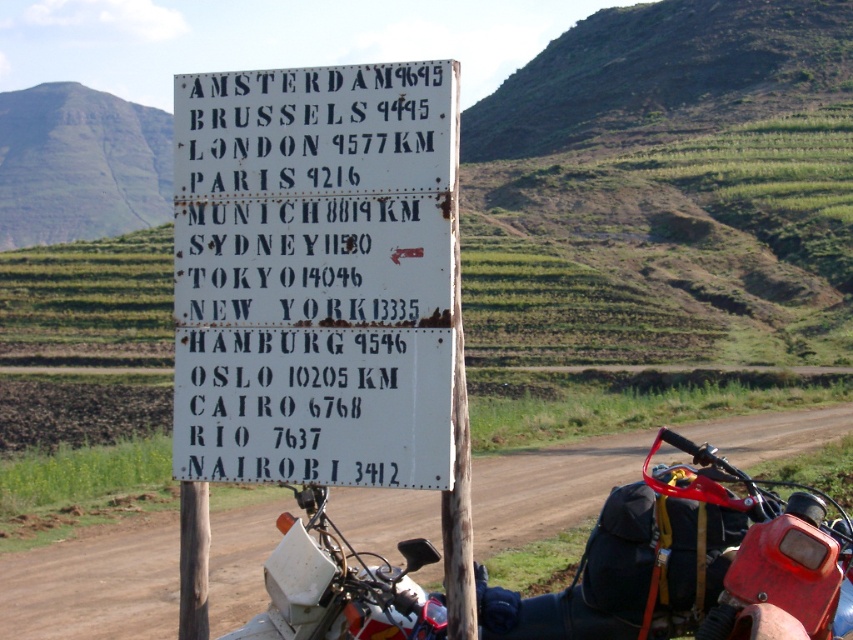
You are a traveler standing at the roadside scene. You see a white paper sign at center and a red plastic motorcycle at lower right. Which object is closer to your left side?

The white paper sign at center is to the left of red plastic motorcycle at lower right, so the white paper sign at center is closer to your left side.

You are a delivery robot with a 12 meter maximum reach. You need to pick up a package from the white paper sign at center and deliver it to the red plastic motorcycle at lower right. Can your arm reach the motorcycle from the sign?

The distance between the white paper sign at center and the red plastic motorcycle at lower right is 13.41 meters, which exceeds the robot arm reach of 12 meters. Therefore, the robot cannot reach the motorcycle from the sign.

You are a traveler planning a road trip and see the white paper sign at center and the red plastic motorcycle at lower right. Which object is taller?

The white paper sign at center is taller than the red plastic motorcycle at lower right.